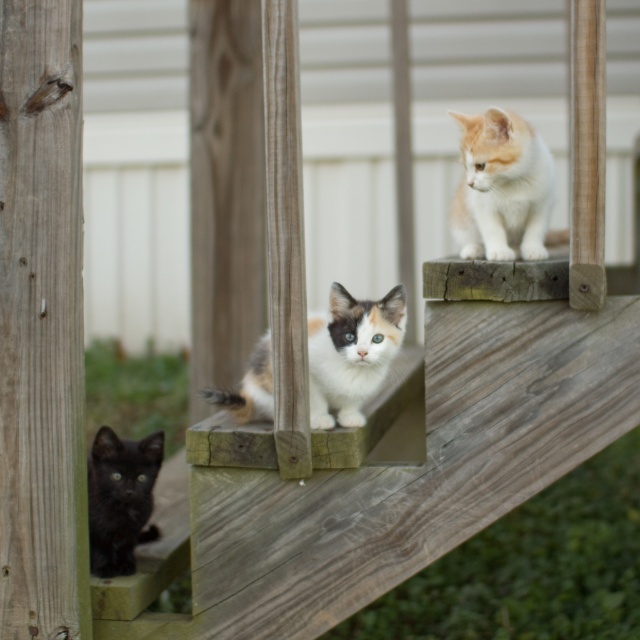
You are a photographer aiming to capture the calico fur cat at center in the best possible focus. Given that your camera has a focal point at coordinate 0.5, 0.5, will the cat be in focus?

The calico fur cat at center is located at 2D coordinates (352, 353), which is very close to the camera focal point at (320, 320). Therefore, the cat will be in focus.

You are standing 10 feet away from the wooden deck railing where the kittens are sitting. There is a specific point at coordinates point (506, 241) on the railing. Can you reach this point with a 12 foot long fishing rod without getting too close to the kittens?

The distance of point (506, 241) from viewer is 10.39 feet, so yes, you can reach the point with a 12 foot long fishing rod since it is longer than the distance required.

You are a photographer standing 3 meters away from a calico fur cat at center. You want to take a closeup photo of it. Can you get within 3 meters to take the photo?

The calico fur cat at center is 2.91 meters away from the camera, so yes, you can get within 3 meters to take the closeup photo.